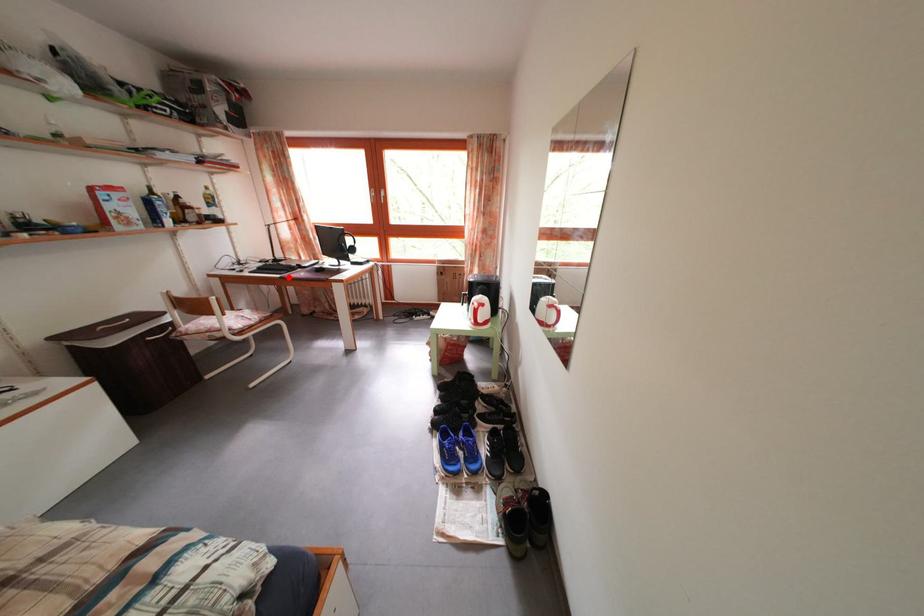
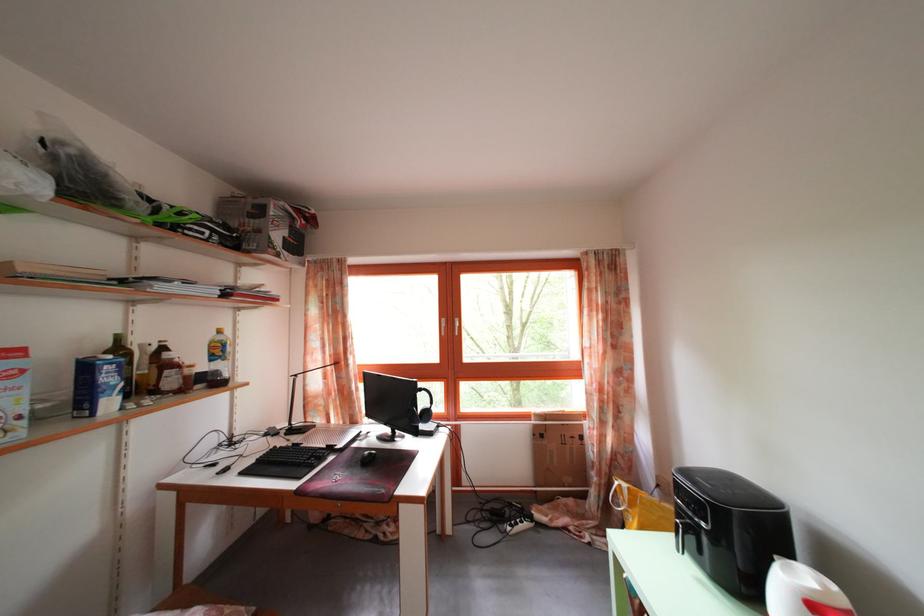
Question: I am providing you with two images of the same scene from different viewpoints. A red point is marked on the first image. Is the red point's position out of view in image 2?

Choices:
 (A) Yes
 (B) No

Answer: (B)